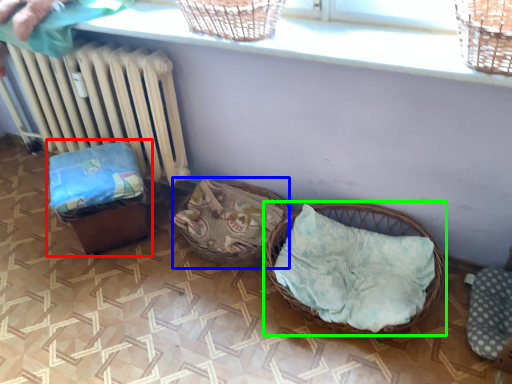
Question: Estimate the real-world distances between objects in this image. Which object is closer to baby carriage (highlighted by a red box), basket (highlighted by a blue box) or picnic basket (highlighted by a green box)?

Choices:
 (A) basket
 (B) picnic basket

Answer: (A)